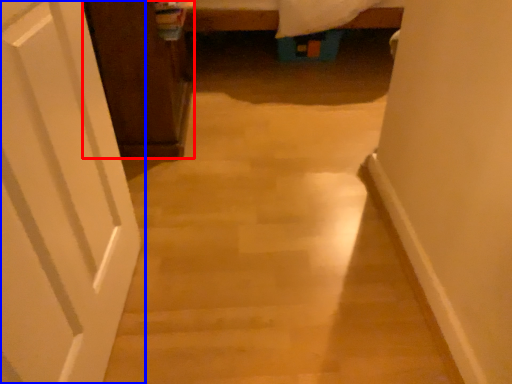
Question: Which object appears closest to the camera in this image, cabinetry (highlighted by a red box) or door (highlighted by a blue box)?

Choices:
 (A) cabinetry
 (B) door

Answer: (B)